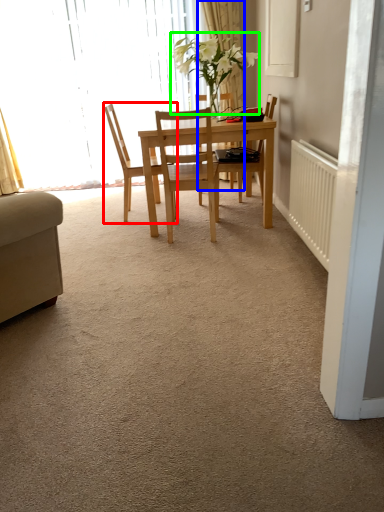
Question: Estimate the real-world distances between objects in this image. Which object is closer to chair (highlighted by a red box), curtain (highlighted by a blue box) or plant (highlighted by a green box)?

Choices:
 (A) curtain
 (B) plant

Answer: (B)